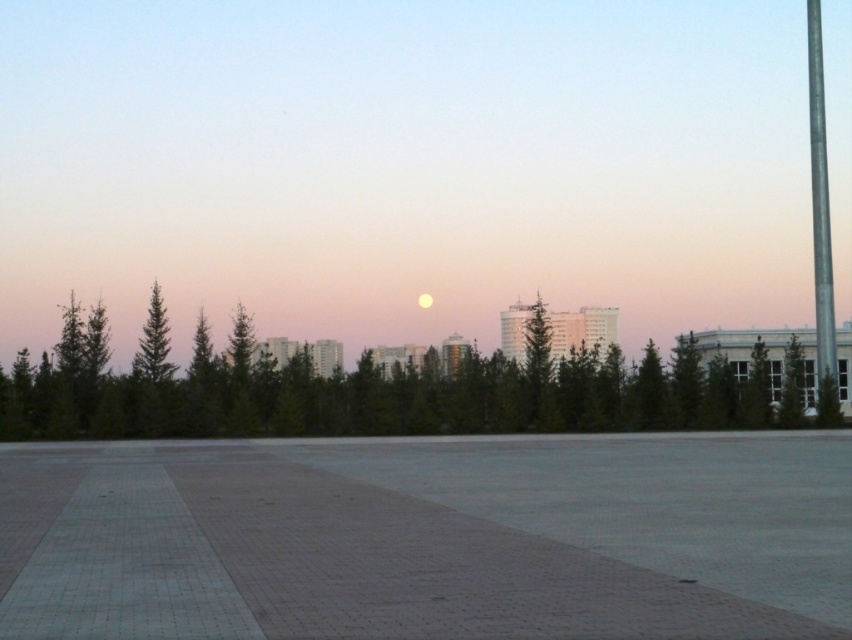
You are standing at the point marked by coordinates point (363, 388) in the image. Looking around, you notice a green leafy tree at center. Can you determine if the tree is in front of or behind your current position?

The green leafy tree at center is represented by point (363, 388), meaning you are standing exactly at the location of the tree. Therefore, the tree is neither in front nor behind your current position.

You are standing in the plaza looking up at the sky. Which object is higher in the sky between the green leafy tree at center and the golden reflective moon at center?

The golden reflective moon at center is higher in the sky than the green leafy tree at center because the green leafy tree at center is located below it.